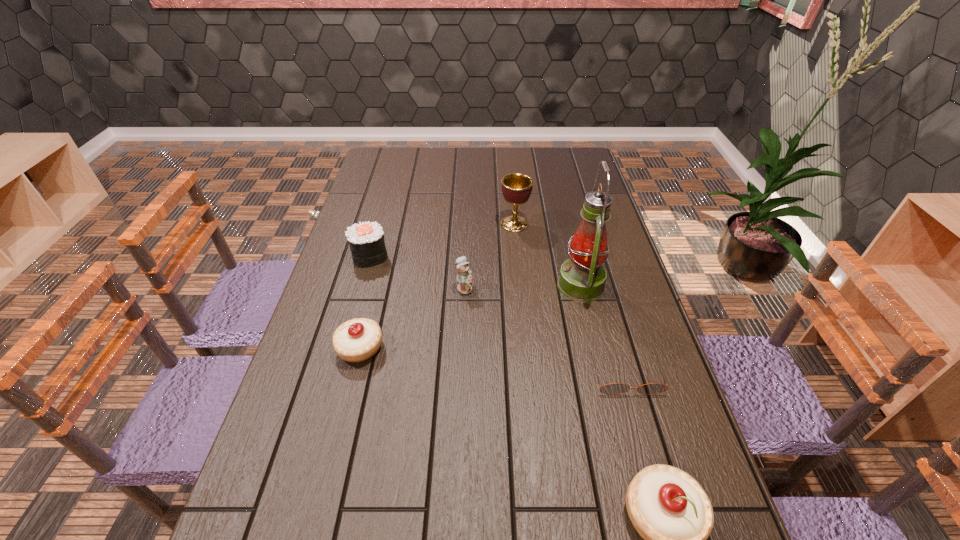
Find the location of `free space at the left edge`. free space at the left edge is located at coordinates (388, 192).

In the image, there is a desktop. Where is `vacant region at the right edge`? The image size is (960, 540). vacant region at the right edge is located at coordinates click(x=636, y=353).

In the image, there is a desktop. Where is `vacant space at the far left corner`? vacant space at the far left corner is located at coordinates (405, 160).

You are a GUI agent. You are given a task and a screenshot of the screen. Output one action in this format:
    pyautogui.click(x=<x>, y=<y>)
    Task: Click on the unoccupied area between the fourth object from left to right and the oil lamp
    The height and width of the screenshot is (540, 960).
    Given the screenshot: What is the action you would take?
    pyautogui.click(x=547, y=255)

Locate an element on the screen. free space between the chalice and the sunglasses is located at coordinates (570, 299).

Locate an element on the screen. free spot between the fifth object from right to left and the oil lamp is located at coordinates (522, 287).

This screenshot has width=960, height=540. Identify the location of free space between the sushi and the oil lamp. (475, 271).

Find the location of a particular element. The width and height of the screenshot is (960, 540). vacant region between the sushi and the left pastry is located at coordinates (365, 302).

The width and height of the screenshot is (960, 540). I want to click on empty location between the sixth tallest object and the sushi, so click(365, 302).

Identify the location of the second closest object to the tallest object. (516, 187).